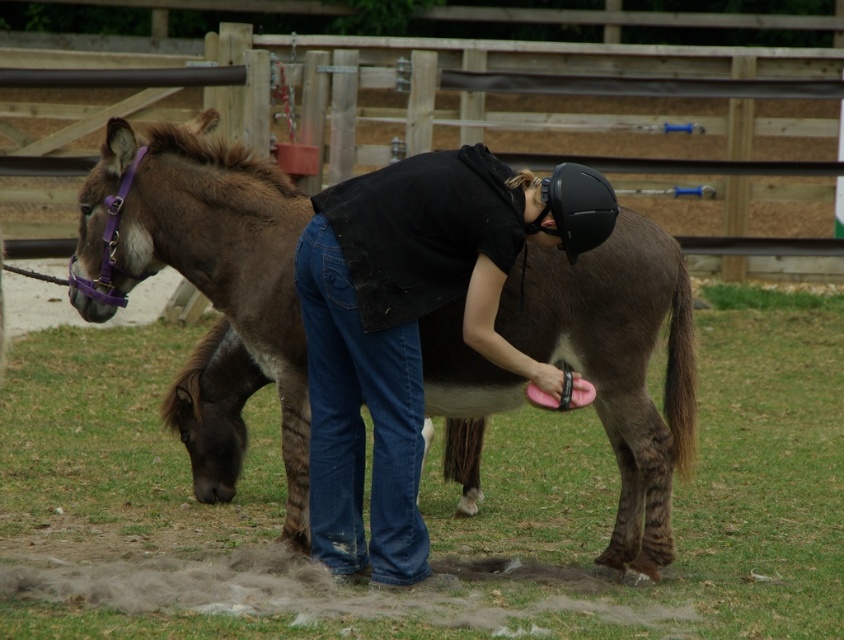
Which is more to the right, brown matte mule at center or black matte helmet at upper center?

Positioned to the right is brown matte mule at center.

Who is lower down, brown matte mule at center or black matte helmet at upper center?

brown matte mule at center is lower down.

Does point (621, 476) lie in front of point (333, 289)?

No, it is behind (333, 289).

Identify the location of brown matte mule at center. The height and width of the screenshot is (640, 844). click(214, 289).

Is point (404, 209) positioned behind point (607, 230)?

That is False.

Looking at this image, does black matte helmet at upper center appear on the right side of black matte helmet at center?

Incorrect, black matte helmet at upper center is not on the right side of black matte helmet at center.

Between point (387, 376) and point (592, 212), which one is positioned in front?

Point (592, 212) is more forward.

This screenshot has width=844, height=640. What are the coordinates of `black matte helmet at upper center` in the screenshot? It's located at (414, 324).

Is point (444, 412) more distant than point (556, 195)?

That is True.

Can you confirm if brown matte mule at center is smaller than black matte helmet at center?

No, brown matte mule at center is not smaller than black matte helmet at center.

Between point (301, 365) and point (612, 224), which one is positioned behind?

The point (301, 365) is behind.

Locate an element on the screen. The image size is (844, 640). brown matte mule at center is located at coordinates (214, 289).